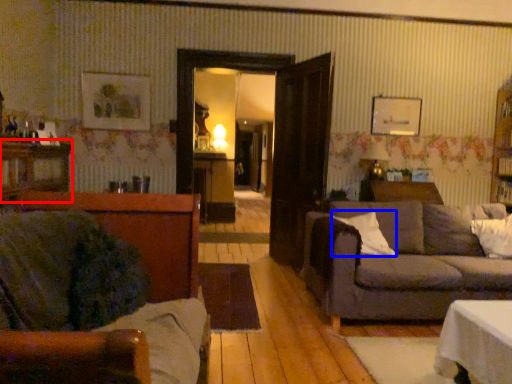
Question: Which point is closer to the camera, dresser (highlighted by a red box) or pillow (highlighted by a blue box)?

Choices:
 (A) dresser
 (B) pillow

Answer: (A)